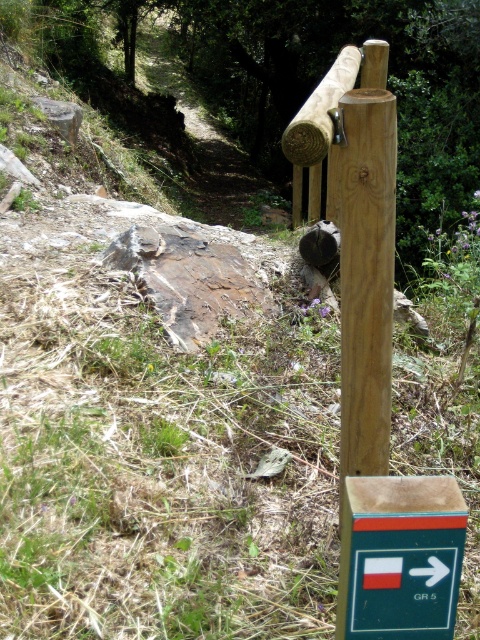
Can you confirm if green plastic sign at center-right is positioned below smooth brown log at upper center?

Indeed, green plastic sign at center-right is positioned under smooth brown log at upper center.

Describe the element at coordinates (399, 557) in the screenshot. I see `green plastic sign at center-right` at that location.

Find the location of a particular element. The height and width of the screenshot is (640, 480). green plastic sign at center-right is located at coordinates (399, 557).

You are a GUI agent. You are given a task and a screenshot of the screen. Output one action in this format:
    pyautogui.click(x=<x>, y=<y>)
    Task: Click on the green plastic sign at center-right
    Image resolution: width=480 pixels, height=640 pixels.
    Given the screenshot: What is the action you would take?
    pyautogui.click(x=399, y=557)